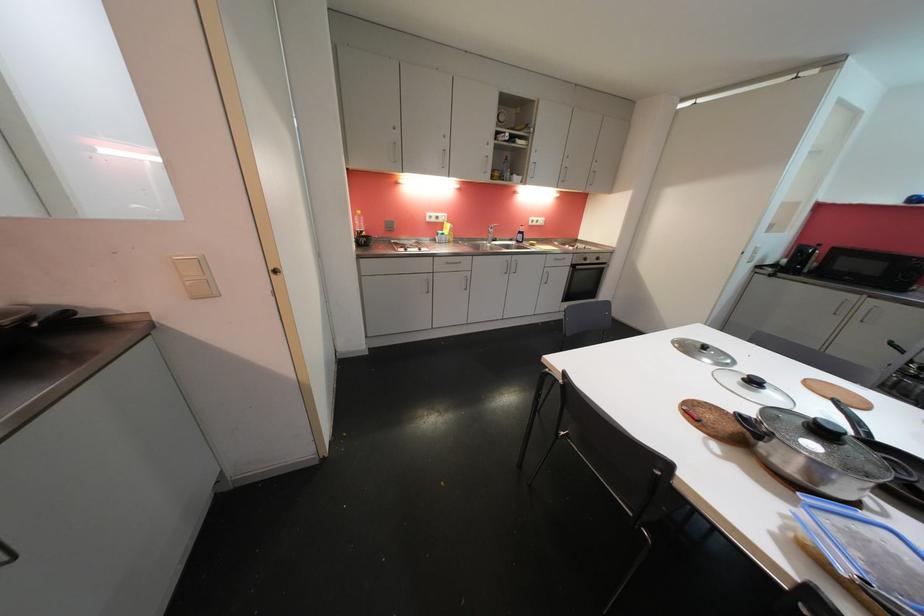
Where would you pull the metal drawer handle? Please return your answer as a coordinate pair (x, y).

(427, 285)